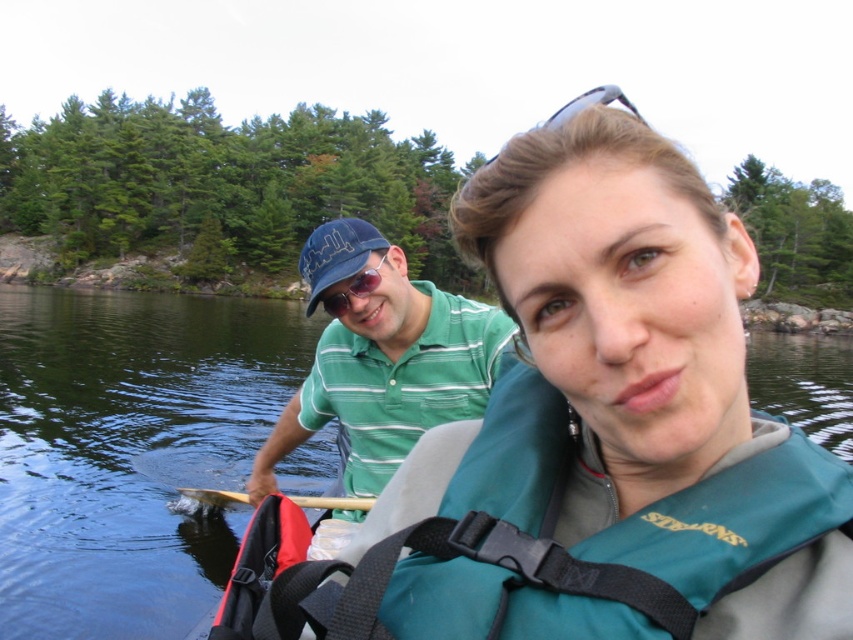
Image resolution: width=853 pixels, height=640 pixels. In order to click on green striped polo shirt at center in this screenshot , I will do `click(381, 356)`.

Does green striped polo shirt at center lie in front of brown wood paddle at lower center?

Yes, green striped polo shirt at center is in front of brown wood paddle at lower center.

Is point (392, 428) positioned after point (352, 506)?

No, it is in front of (352, 506).

Locate an element on the screen. green striped polo shirt at center is located at coordinates (381, 356).

Is point (229, 500) in front of point (564, 113)?

No, it is not.

Between brown wood paddle at lower center and sunglasses at upper center, which one is positioned lower?

brown wood paddle at lower center is lower down.

Which is in front, point (219, 500) or point (585, 99)?

Point (585, 99) is more forward.

Locate an element on the screen. This screenshot has width=853, height=640. brown wood paddle at lower center is located at coordinates (334, 502).

Who is taller, teal life vest at center or green water at center?

green water at center is taller.

Image resolution: width=853 pixels, height=640 pixels. What are the coordinates of `teal life vest at center` in the screenshot? It's located at (631, 387).

Does point (415, 572) lie behind point (263, 352)?

No, (415, 572) is closer to viewer.

This screenshot has width=853, height=640. I want to click on teal life vest at center, so (x=631, y=387).